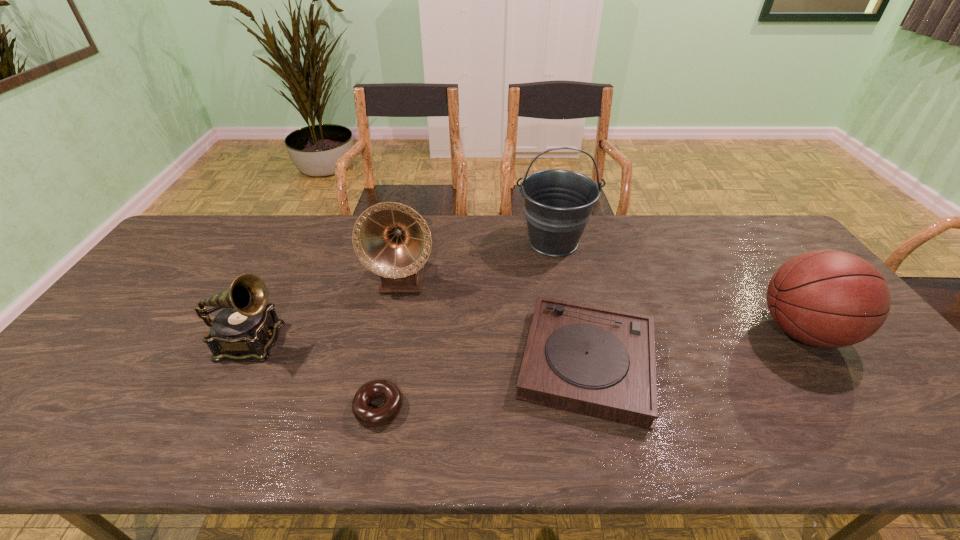
The image size is (960, 540). Find the location of `vacant area that lies between the tallest object and the shortest object`. vacant area that lies between the tallest object and the shortest object is located at coordinates (467, 325).

The image size is (960, 540). In order to click on vacant space that is in between the second phonograph record from left to right and the shortest object in this screenshot , I will do [x=391, y=343].

At what (x,y) coordinates should I click in order to perform the action: click on object that is the fourth closest one to the bucket. Please return your answer as a coordinate pair (x, y). This screenshot has height=540, width=960. Looking at the image, I should click on (372, 417).

Choose which object is the nearest neighbor to the bucket. Please provide its 2D coordinates. Your answer should be formatted as a tuple, i.e. [(x, y)], where the tuple contains the x and y coordinates of a point satisfying the conditions above.

[(600, 362)]

Locate an element on the screen. The height and width of the screenshot is (540, 960). phonograph record identified as the closest to the shortest phonograph record is located at coordinates (392, 240).

You are a GUI agent. You are given a task and a screenshot of the screen. Output one action in this format:
    pyautogui.click(x=<x>, y=<y>)
    Task: Click on the phonograph record object that ranks as the closest to the fifth tallest object
    This screenshot has height=540, width=960.
    Given the screenshot: What is the action you would take?
    pyautogui.click(x=392, y=240)

Where is `blank area in the image that satisfies the following two spatial constraints: 1. on the horn of the farthest phonograph record; 2. on the left side of the rightmost phonograph record`? The width and height of the screenshot is (960, 540). blank area in the image that satisfies the following two spatial constraints: 1. on the horn of the farthest phonograph record; 2. on the left side of the rightmost phonograph record is located at coordinates pyautogui.click(x=386, y=362).

What are the coordinates of `free region that satisfies the following two spatial constraints: 1. on the front side of the basketball; 2. on the horn of the leftmost object` in the screenshot? It's located at (810, 342).

Where is `vacant area in the image that satisfies the following two spatial constraints: 1. on the horn of the rightmost object; 2. on the right side of the farthest phonograph record`? vacant area in the image that satisfies the following two spatial constraints: 1. on the horn of the rightmost object; 2. on the right side of the farthest phonograph record is located at coordinates (392, 332).

Where is `vacant point that satisfies the following two spatial constraints: 1. on the horn of the leftmost object; 2. on the right side of the doughnut`? The height and width of the screenshot is (540, 960). vacant point that satisfies the following two spatial constraints: 1. on the horn of the leftmost object; 2. on the right side of the doughnut is located at coordinates (218, 407).